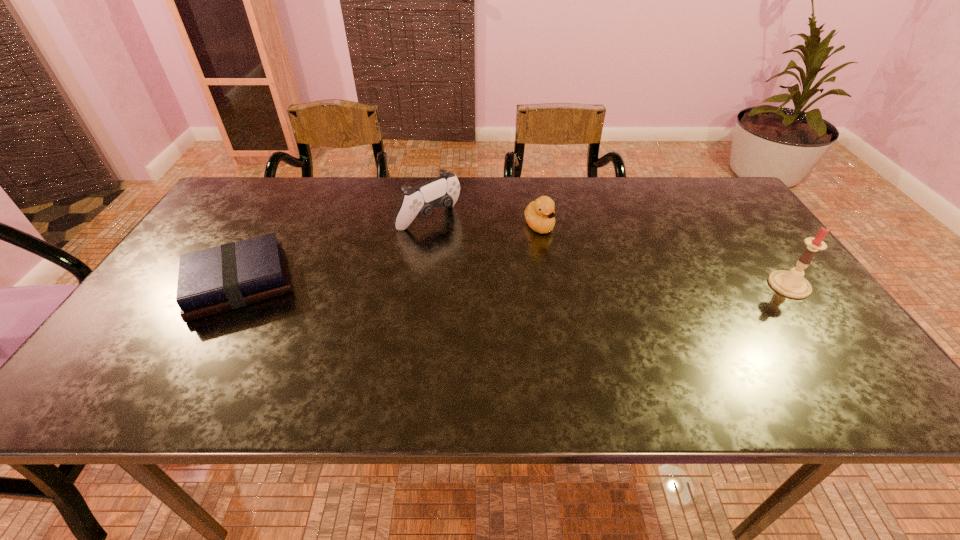
Locate an element on the screen. Image resolution: width=960 pixels, height=540 pixels. vacant spot on the desktop that is between the book and the candle and is positioned on the front-facing side of the third shortest object is located at coordinates (516, 285).

Where is `vacant space on the desktop that is between the book and the rightmost object and is positioned facing forward on the third object from left to right`? This screenshot has height=540, width=960. vacant space on the desktop that is between the book and the rightmost object and is positioned facing forward on the third object from left to right is located at coordinates point(588,285).